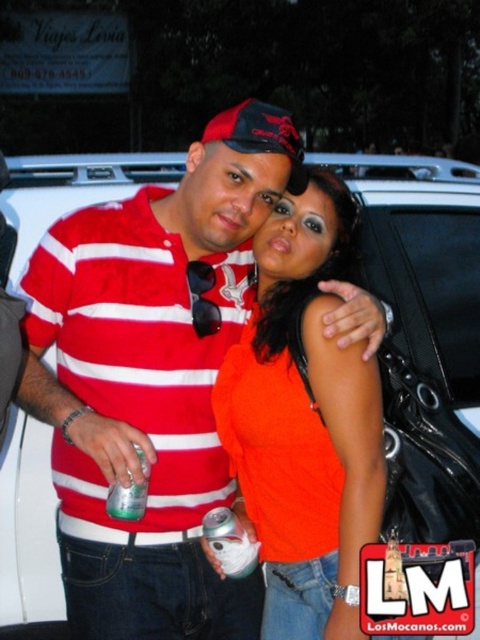
Question: Can you confirm if matte orange shirt at center is wider than green translucent can at center?

Choices:
 (A) yes
 (B) no

Answer: (A)

Question: Which point is farther from the camera taking this photo?

Choices:
 (A) (230, 528)
 (B) (267, 541)
 (C) (113, 513)

Answer: (B)

Question: Is matte orange shirt at center to the left of green matte can at center from the viewer's perspective?

Choices:
 (A) yes
 (B) no

Answer: (B)

Question: Is matte orange shirt at center to the left of green translucent can at center from the viewer's perspective?

Choices:
 (A) yes
 (B) no

Answer: (B)

Question: Which is farther from the green matte can at center?

Choices:
 (A) matte orange shirt at center
 (B) green translucent can at center

Answer: (A)

Question: Which point is closer to the camera taking this photo?

Choices:
 (A) (245, 401)
 (B) (117, 515)
 (C) (229, 532)

Answer: (B)